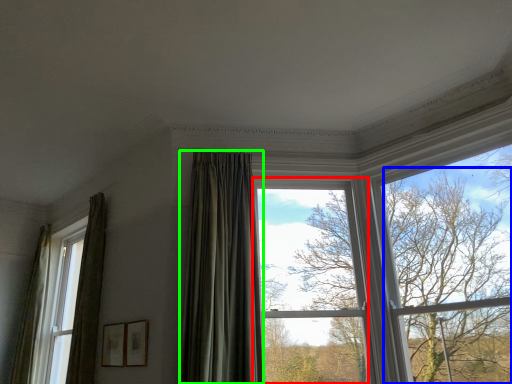
Question: Which is nearer to the window (highlighted by a red box)? tree (highlighted by a blue box) or curtain (highlighted by a green box).

Choices:
 (A) tree
 (B) curtain

Answer: (B)